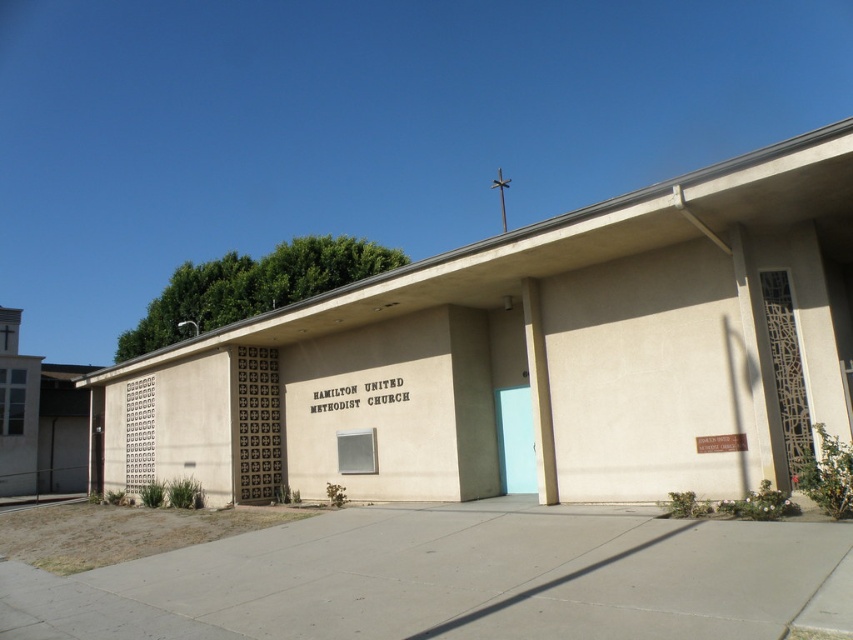
Question: Which of the following is the closest to the observer?

Choices:
 (A) (505, 388)
 (B) (263, 404)

Answer: (A)

Question: Which point appears closest to the camera in this image?

Choices:
 (A) (531, 467)
 (B) (262, 486)

Answer: (A)

Question: Is brown textured door at center closer to the viewer compared to light blue matte door at center?

Choices:
 (A) no
 (B) yes

Answer: (A)

Question: Can you confirm if brown textured door at center is positioned below light blue matte door at center?

Choices:
 (A) no
 (B) yes

Answer: (B)

Question: Is brown textured door at center to the left of light blue matte door at center from the viewer's perspective?

Choices:
 (A) yes
 (B) no

Answer: (A)